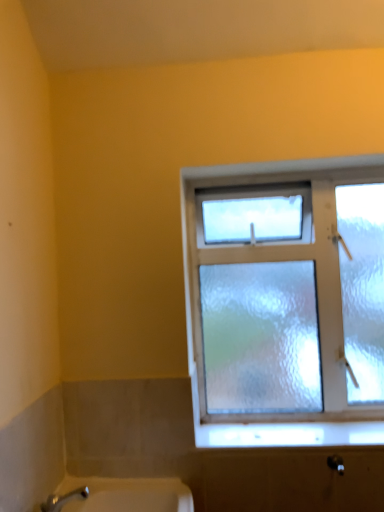
Question: From a real-world perspective, is frosted glass window at upper right physically located above or below white frosted glass at lower center?

Choices:
 (A) below
 (B) above

Answer: (B)

Question: In terms of size, does frosted glass window at upper right appear bigger or smaller than white frosted glass at lower center?

Choices:
 (A) big
 (B) small

Answer: (A)

Question: Choose the correct answer: Is frosted glass window at upper right inside white frosted glass at lower center or outside it?

Choices:
 (A) outside
 (B) inside

Answer: (A)

Question: Considering the positions of white frosted glass at lower center and frosted glass window at upper right in the image, is white frosted glass at lower center wider or thinner than frosted glass window at upper right?

Choices:
 (A) wide
 (B) thin

Answer: (A)

Question: From a real-world perspective, is white frosted glass at lower center physically located above or below frosted glass window at upper right?

Choices:
 (A) above
 (B) below

Answer: (B)

Question: Considering their positions, is white frosted glass at lower center located in front of or behind frosted glass window at upper right?

Choices:
 (A) behind
 (B) front

Answer: (B)

Question: Is white frosted glass at lower center inside or outside of frosted glass window at upper right?

Choices:
 (A) inside
 (B) outside

Answer: (B)